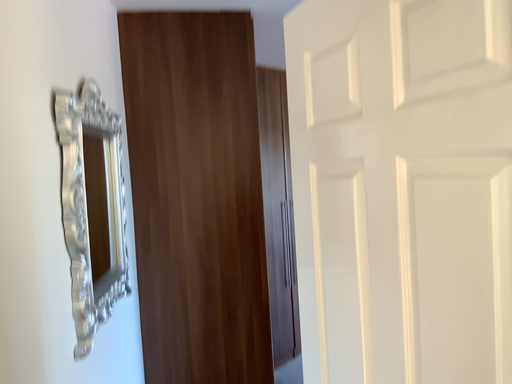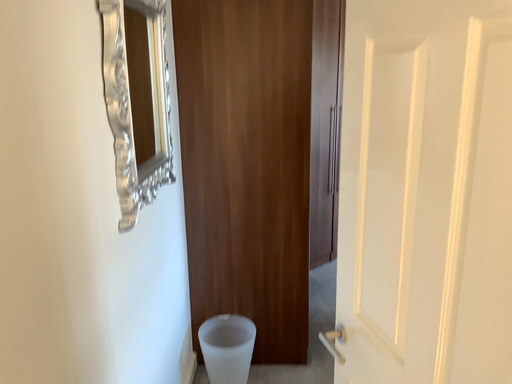
Question: Which way did the camera rotate in the video?

Choices:
 (A) rotated downward
 (B) rotated upward

Answer: (A)